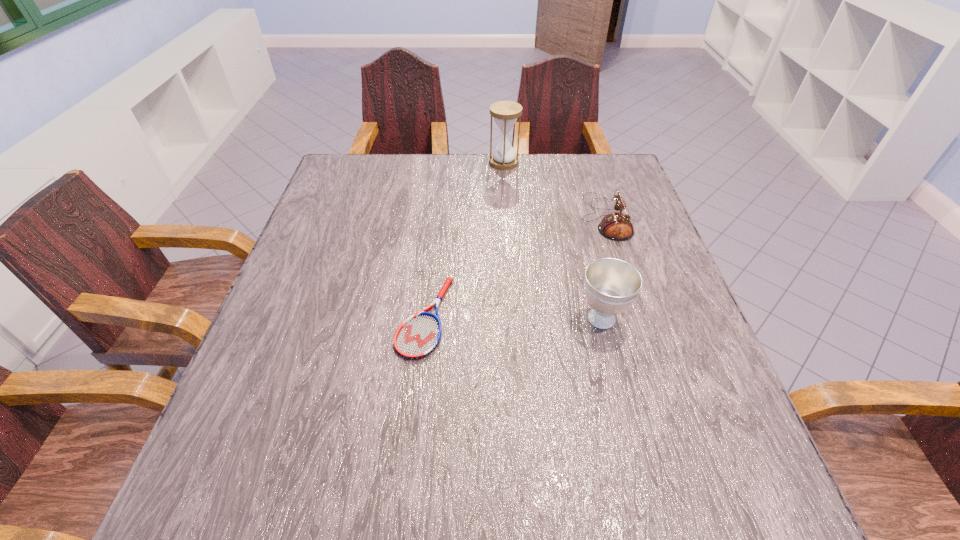
Locate an element on the screen. This screenshot has width=960, height=540. free space between the chalice and the shortest object is located at coordinates (514, 318).

The height and width of the screenshot is (540, 960). I want to click on free space between the third shortest object and the shortest object, so click(x=514, y=318).

You are a GUI agent. You are given a task and a screenshot of the screen. Output one action in this format:
    pyautogui.click(x=<x>, y=<y>)
    Task: Click on the vacant space in between the chalice and the tallest object
    
    Given the screenshot: What is the action you would take?
    pyautogui.click(x=553, y=240)

This screenshot has height=540, width=960. Find the location of `object that is the second nearest to the tallest object`. object that is the second nearest to the tallest object is located at coordinates (418, 336).

Locate which object is the closest to the chalice. Please provide its 2D coordinates. Your answer should be formatted as a tuple, i.e. [(x, y)], where the tuple contains the x and y coordinates of a point satisfying the conditions above.

[(616, 226)]

Find the location of a particular element. This screenshot has height=540, width=960. free point that satisfies the following two spatial constraints: 1. on the front side of the hourglass; 2. on the right side of the chalice is located at coordinates (516, 319).

Where is `free space that satisfies the following two spatial constraints: 1. on the rotary dial of the second farthest object; 2. on the front side of the chalice`? This screenshot has width=960, height=540. free space that satisfies the following two spatial constraints: 1. on the rotary dial of the second farthest object; 2. on the front side of the chalice is located at coordinates (638, 319).

Locate an element on the screen. blank area in the image that satisfies the following two spatial constraints: 1. on the back side of the leftmost object; 2. on the right side of the hourglass is located at coordinates (443, 163).